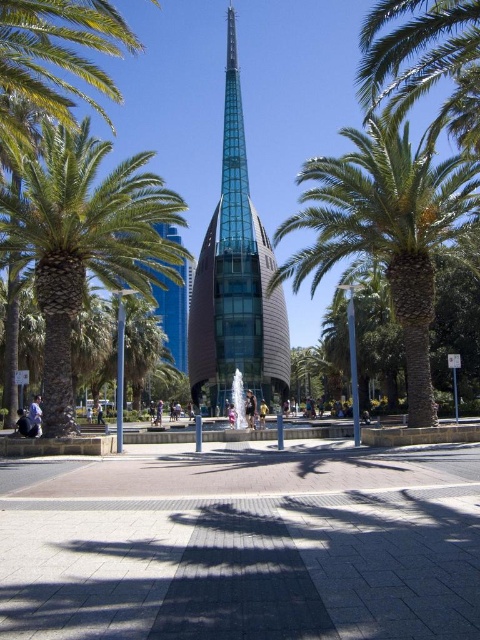
How far apart are green leafy palm tree at center and transparent glass spire at center?

A distance of 47.11 meters exists between green leafy palm tree at center and transparent glass spire at center.

Describe the element at coordinates (385, 230) in the screenshot. I see `green leafy palm tree at center` at that location.

Locate an element on the screen. This screenshot has height=640, width=480. green leafy palm tree at center is located at coordinates (385, 230).

Is green leafy palm tree at left shorter than green leafy palm tree at center?

Yes, green leafy palm tree at left is shorter than green leafy palm tree at center.

Consider the image. Between green leafy palm tree at left and green leafy palm tree at center, which one appears on the right side from the viewer's perspective?

From the viewer's perspective, green leafy palm tree at center appears more on the right side.

Locate an element on the screen. The height and width of the screenshot is (640, 480). green leafy palm tree at left is located at coordinates (84, 241).

How much distance is there between green leafy palm tree at left and transparent glass spire at center?

green leafy palm tree at left is 160.89 feet away from transparent glass spire at center.

Which of these two, green leafy palm tree at left or transparent glass spire at center, stands taller?

A: Standing taller between the two is transparent glass spire at center.

Locate an element on the screen. This screenshot has height=640, width=480. green leafy palm tree at left is located at coordinates (84, 241).